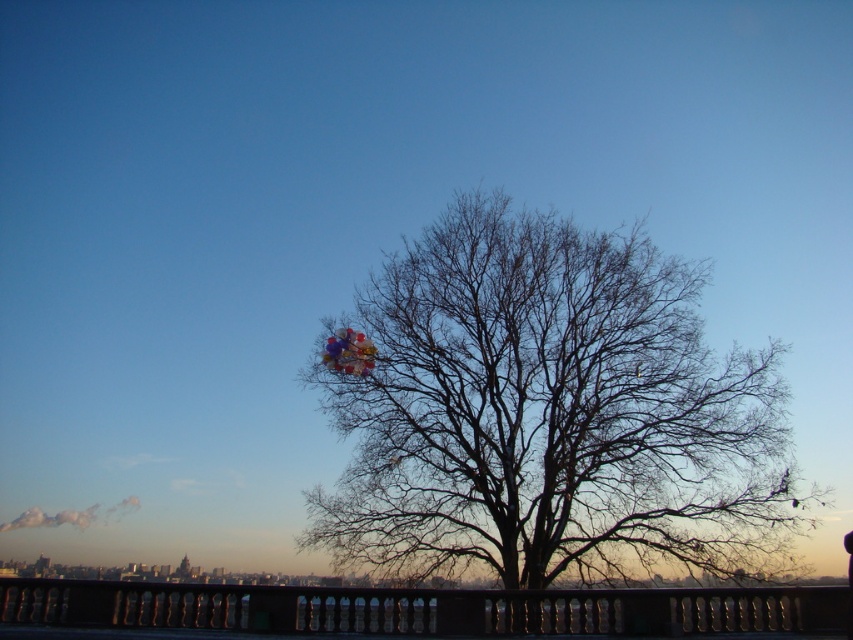
In the scene shown: You are a photographer trying to capture a clear image of the multicolored glossy balloons at center without the bare branches at center obstructing them. Based on their positions, is this possible?

The bare branches at center are in front of the multicolored glossy balloons at center, so they will block the view of the balloons. To capture the balloons clearly, you need to adjust your position or angle to avoid the branches.

You are standing at the base of the large leafless tree in the foreground and see the point marked at coordinate (422, 609). What object is located at that point?

The point at coordinate (422, 609) marks the location of the black metal railing at lower center.